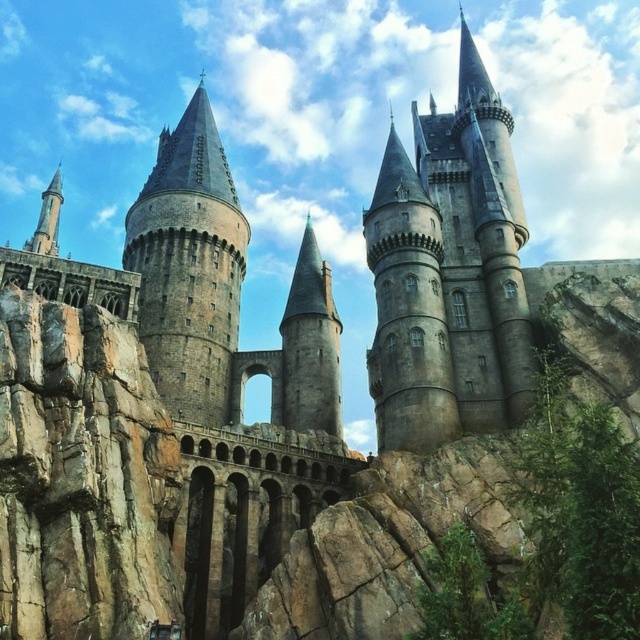
You are an architect examining the castle. You notice two towers labeled as the stone gray tower at center and the smooth gray stone tower at center. Which tower has a greater height?

The stone gray tower at center is taller than the smooth gray stone tower at center.

You are standing at the base of the castle and want to take a photo of the gray stone tower at center. If your camera can focus on objects up to 60 meters away, will it be able to capture the tower clearly?

The gray stone tower at center is 64.36 meters away from the viewer. Since the camera can only focus up to 60 meters, it will not be able to capture the tower clearly.

You are standing at the base of the castle and want to locate the gray stone tower at center. According to the coordinates provided, where should you look relative to your position?

The gray stone tower at center is located at coordinates point (449,273), so you should look towards the upper middle area of the castle structure from your position at the base.